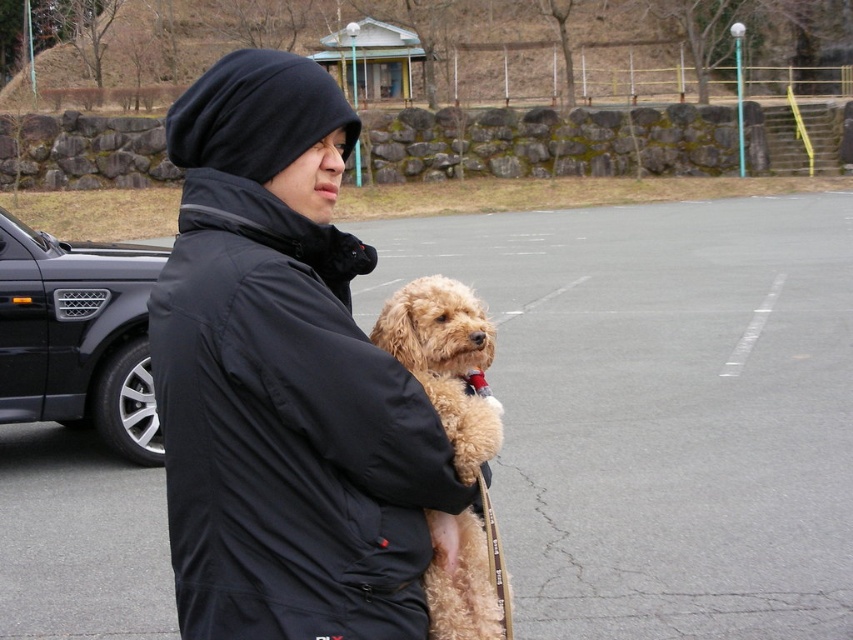
In the scene shown: You are a photographer trying to capture a photo of the black matte jacket at center and the black metallic car at left. Based on their positions, which object should you focus on first if you want to include both in the frame without moving the camera?

The black matte jacket at center is to the right of the black metallic car at left. Since the jacket is positioned further to the right, you should focus on the black metallic car at left first to ensure both are in the frame without moving the camera.

You are standing at the point marked by the coordinates point (662, 408) in the image. What type of surface are you standing on?

The point (662, 408) marks gray asphalt parking lot at center, so you are standing on a gray asphalt parking lot.

You are a photographer trying to capture the black matte jacket at center and the black metallic car at left in the same frame. Based on their sizes in the image, which one would appear smaller?

The black matte jacket at center appears smaller than the black metallic car at left because it is not as tall as the car.